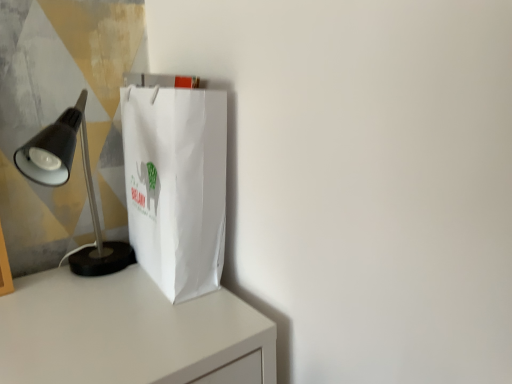
In the scene shown: In order to face white paper bag at center, should I rotate leftwards or rightwards?

You should rotate left by 11.621 degrees.

At what (x,y) coordinates should I click in order to perform the action: click on white paper bag at center. Please return your answer as a coordinate pair (x, y). Looking at the image, I should click on point(176,185).

What do you see at coordinates (176, 185) in the screenshot? I see `white paper bag at center` at bounding box center [176, 185].

The height and width of the screenshot is (384, 512). What do you see at coordinates (67, 181) in the screenshot?
I see `matte black lamp at left` at bounding box center [67, 181].

Identify the location of matte black lamp at left. (67, 181).

In order to face matte black lamp at left, should I rotate leftwards or rightwards?

To align with it, rotate left about 23.205°.

Find the location of a particular element. white paper bag at center is located at coordinates (176, 185).

In the image, is matte black lamp at left on the left side or the right side of white paper bag at center?

From the image, it's evident that matte black lamp at left is to the left of white paper bag at center.

Who is more distant, matte black lamp at left or white paper bag at center?

white paper bag at center is more distant.

Considering the positions of point (42, 176) and point (144, 167), is point (42, 176) closer or farther from the camera than point (144, 167)?

Point (42, 176) appears to be closer to the viewer than point (144, 167).

Consider the image. From the image's perspective, is matte black lamp at left on top of white paper bag at center?

Actually, matte black lamp at left appears below white paper bag at center in the image.

From a real-world perspective, which object rests below the other?

matte black lamp at left, from a real-world perspective.

In terms of width, does matte black lamp at left look wider or thinner when compared to white paper bag at center?

Clearly, matte black lamp at left has more width compared to white paper bag at center.

Can you confirm if matte black lamp at left is shorter than white paper bag at center?

Indeed, matte black lamp at left has a lesser height compared to white paper bag at center.

Can you confirm if matte black lamp at left is bigger than white paper bag at center?

Indeed, matte black lamp at left has a larger size compared to white paper bag at center.

Is white paper bag at center completely or partially inside matte black lamp at left?

No, matte black lamp at left does not contain white paper bag at center.

Are matte black lamp at left and white paper bag at center located far from each other?

That's not correct — matte black lamp at left is a little close to white paper bag at center.

Is matte black lamp at left aimed at white paper bag at center?

No, matte black lamp at left does not turn towards white paper bag at center.

Can you tell me how much matte black lamp at left and white paper bag at center differ in facing direction?

They differ by 59.6 degrees in their facing directions.

I want to click on lamp below the white paper bag at center (from a real-world perspective), so click(67, 181).

In the scene shown: Which object is positioned more to the right, white paper bag at center or matte black lamp at left?

white paper bag at center.

Is white paper bag at center closer to the viewer compared to matte black lamp at left?

No, the depth of white paper bag at center is greater than that of matte black lamp at left.

Is point (166, 274) closer or farther from the camera than point (36, 161)?

Clearly, point (166, 274) is more distant from the camera than point (36, 161).

From the image's perspective, between white paper bag at center and matte black lamp at left, who is located below?

matte black lamp at left appears lower in the image.

From a real-world perspective, is white paper bag at center on top of matte black lamp at left?

Yes.

Does white paper bag at center have a lesser width compared to matte black lamp at left?

Yes, white paper bag at center is thinner than matte black lamp at left.

In terms of height, does white paper bag at center look taller or shorter compared to matte black lamp at left?

Clearly, white paper bag at center is taller compared to matte black lamp at left.

Which of these two, white paper bag at center or matte black lamp at left, is bigger?

matte black lamp at left.

Is white paper bag at center located outside matte black lamp at left?

Indeed, white paper bag at center is completely outside matte black lamp at left.

Is white paper bag at center not close to matte black lamp at left?

They are positioned close to each other.

Is white paper bag at center looking in the opposite direction of matte black lamp at left?

Correct, white paper bag at center is looking away from matte black lamp at left.

Can you tell me how much white paper bag at center and matte black lamp at left differ in facing direction?

59.6 degrees.

This screenshot has width=512, height=384. I want to click on lamp in front of the white paper bag at center, so click(x=67, y=181).

Find the location of a particular element. Image resolution: width=512 pixels, height=384 pixels. lamp below the white paper bag at center (from a real-world perspective) is located at coordinates (67, 181).

Image resolution: width=512 pixels, height=384 pixels. I want to click on lamp on the left of white paper bag at center, so click(67, 181).